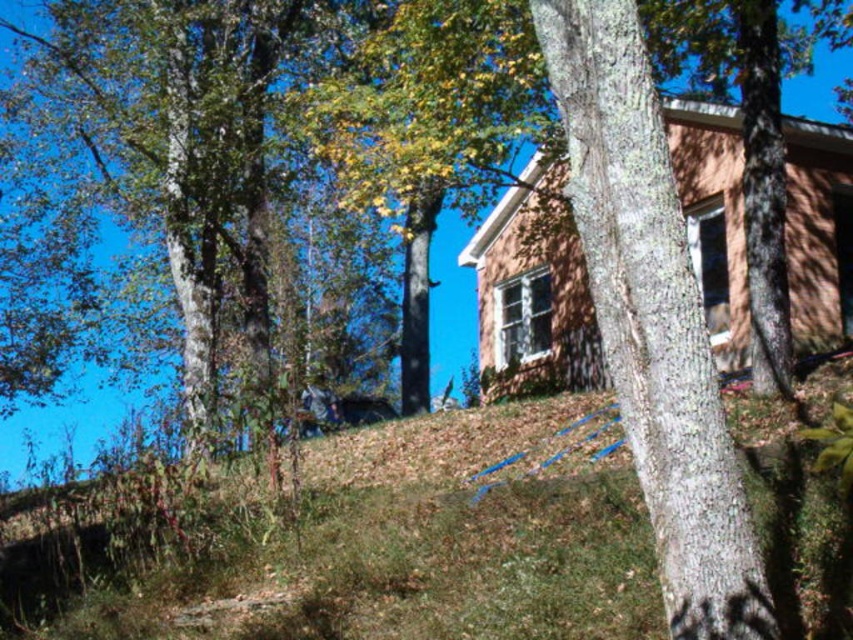
Question: Which point is farther from the camera taking this photo?

Choices:
 (A) (643, 486)
 (B) (741, 296)

Answer: (B)

Question: Can you confirm if smooth bark tree at center is bigger than rustic wooden cabin at center?

Choices:
 (A) yes
 (B) no

Answer: (B)

Question: Is smooth bark tree at center below rustic wooden cabin at center?

Choices:
 (A) no
 (B) yes

Answer: (B)

Question: Does smooth bark tree at center appear on the right side of rustic wooden cabin at center?

Choices:
 (A) no
 (B) yes

Answer: (A)